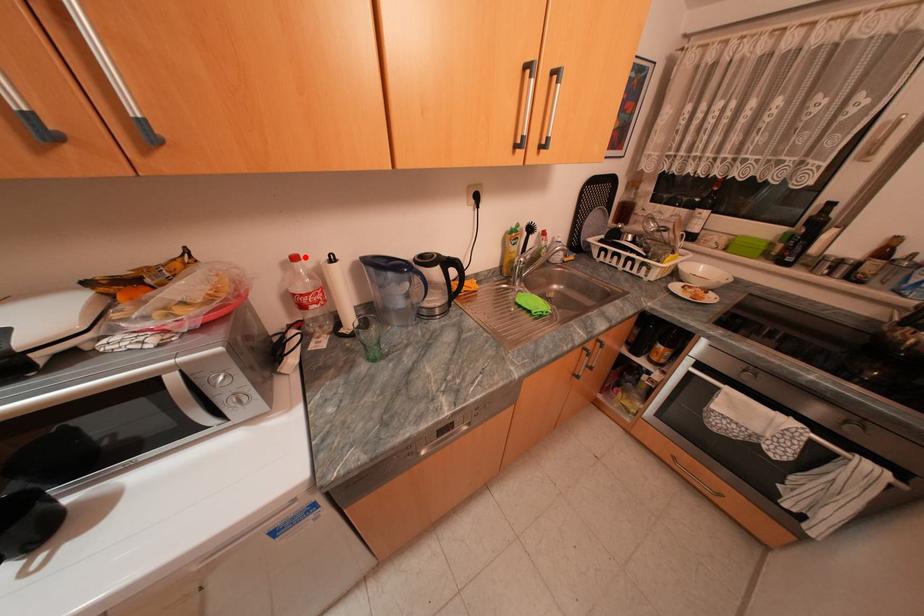
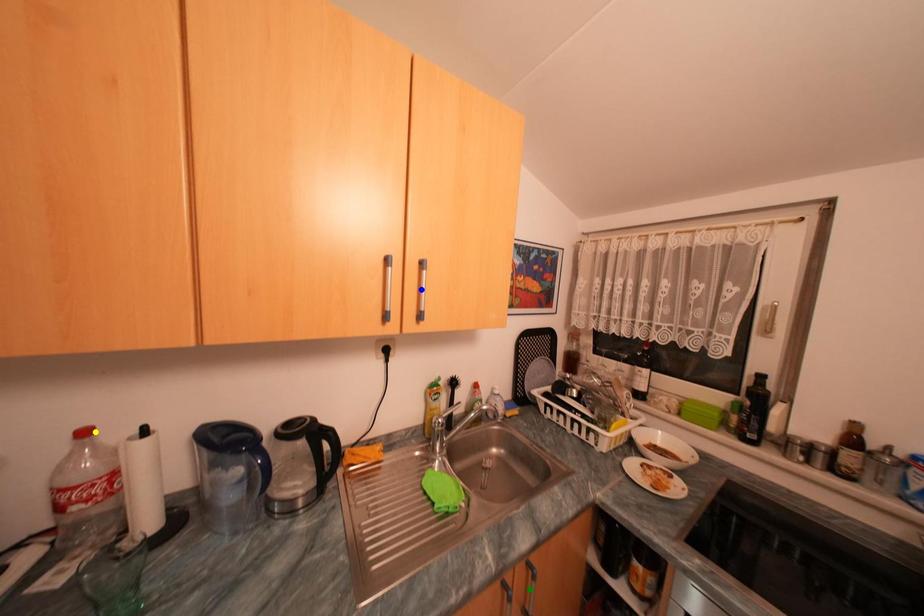
Question: I am providing you with two images of the same scene from different viewpoints. A red point is marked on the first image. You are given multiple points on the second image. Which spot in image 2 lines up with the point in image 1?

Choices:
 (A) green point
 (B) yellow point
 (C) blue point

Answer: (B)